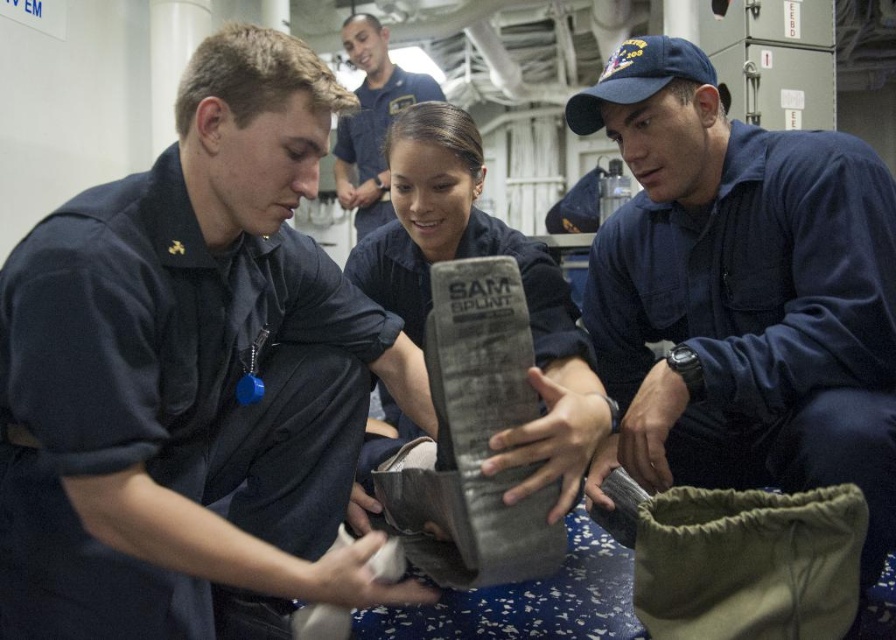
Who is positioned more to the left, navy blue uniform at center or matte gray splint at center?

Positioned to the left is matte gray splint at center.

Can you confirm if navy blue uniform at center is wider than matte gray splint at center?

Yes, navy blue uniform at center is wider than matte gray splint at center.

At what (x,y) coordinates should I click in order to perform the action: click on navy blue uniform at center. Please return your answer as a coordinate pair (x, y). Image resolution: width=896 pixels, height=640 pixels. Looking at the image, I should click on (741, 294).

Is matte gray splint at center behind blue uniform shirt at upper center?

No, it is in front of blue uniform shirt at upper center.

Is point (401, 275) positioned before point (382, 90)?

Yes, point (401, 275) is in front of point (382, 90).

Who is more distant from viewer, [472,216] or [341,120]?

Positioned behind is point [341,120].

Locate an element on the screen. This screenshot has height=640, width=896. matte gray splint at center is located at coordinates (475, 257).

Is matte black uniform at center taller than navy blue uniform at center?

No, matte black uniform at center is not taller than navy blue uniform at center.

Who is positioned more to the left, matte black uniform at center or navy blue uniform at center?

From the viewer's perspective, matte black uniform at center appears more on the left side.

Between point (311, 92) and point (777, 380), which one is positioned behind?

The point (777, 380) is more distant.

Locate an element on the screen. matte black uniform at center is located at coordinates (191, 372).